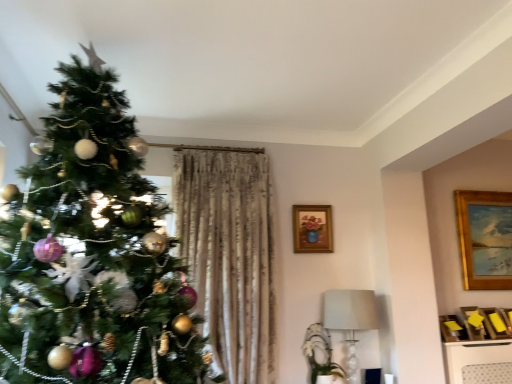
Question: From the image's perspective, is gold wooden picture frame at upper right, marked as the second picture frame in a left-to-right arrangement, below wooden frame with floral painting at upper center, the 1th picture frame in the left-to-right sequence?

Choices:
 (A) yes
 (B) no

Answer: (A)

Question: Are gold wooden picture frame at upper right, marked as the first picture frame in a right-to-left arrangement, and wooden frame with floral painting at upper center, placed as the 2th picture frame when sorted from right to left, located far from each other?

Choices:
 (A) no
 (B) yes

Answer: (B)

Question: Is gold wooden picture frame at upper right, arranged as the 2th picture frame when viewed from the front, to the left of wooden frame with floral painting at upper center, which is the second picture frame from back to front, from the viewer's perspective?

Choices:
 (A) no
 (B) yes

Answer: (A)

Question: Is gold wooden picture frame at upper right, marked as the first picture frame in a right-to-left arrangement, completely or partially outside of wooden frame with floral painting at upper center, which is the second picture frame from back to front?

Choices:
 (A) yes
 (B) no

Answer: (A)

Question: Is gold wooden picture frame at upper right, arranged as the 2th picture frame when viewed from the front, placed right next to wooden frame with floral painting at upper center, placed as the 2th picture frame when sorted from right to left?

Choices:
 (A) yes
 (B) no

Answer: (B)

Question: From a real-world perspective, is gold wooden picture frame at upper right, marked as the second picture frame in a left-to-right arrangement, physically above wooden frame with floral painting at upper center, placed as the 2th picture frame when sorted from right to left?

Choices:
 (A) no
 (B) yes

Answer: (A)

Question: From the image's perspective, is wooden frame with floral painting at upper center, placed as the 2th picture frame when sorted from right to left, beneath shiny metallic ornaments at left?

Choices:
 (A) no
 (B) yes

Answer: (B)

Question: Is shiny metallic ornaments at left surrounded by wooden frame with floral painting at upper center, which is the second picture frame from back to front?

Choices:
 (A) no
 (B) yes

Answer: (A)

Question: From a real-world perspective, is wooden frame with floral painting at upper center, which is the second picture frame from back to front, positioned over shiny metallic ornaments at left based on gravity?

Choices:
 (A) no
 (B) yes

Answer: (B)

Question: Is shiny metallic ornaments at left at the back of wooden frame with floral painting at upper center, which is the second picture frame from back to front?

Choices:
 (A) yes
 (B) no

Answer: (B)

Question: Is wooden frame with floral painting at upper center, placed as the 2th picture frame when sorted from right to left, aimed at shiny metallic ornaments at left?

Choices:
 (A) yes
 (B) no

Answer: (B)

Question: Is the surface of wooden frame with floral painting at upper center, placed as the 2th picture frame when sorted from right to left, in direct contact with shiny metallic ornaments at left?

Choices:
 (A) yes
 (B) no

Answer: (B)

Question: Is shiny metallic ornaments at left next to gold wooden picture frame at upper right, marked as the first picture frame in a right-to-left arrangement?

Choices:
 (A) no
 (B) yes

Answer: (A)